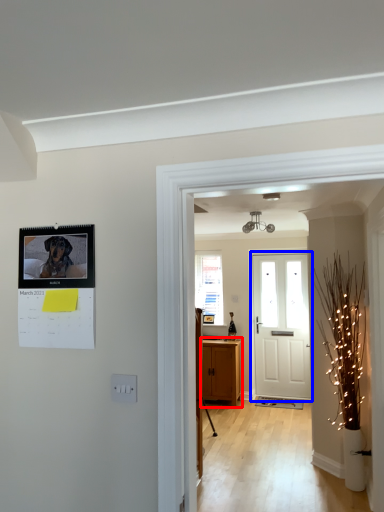
Question: Which object appears farthest to the camera in this image, cabinetry (highlighted by a red box) or door (highlighted by a blue box)?

Choices:
 (A) cabinetry
 (B) door

Answer: (B)